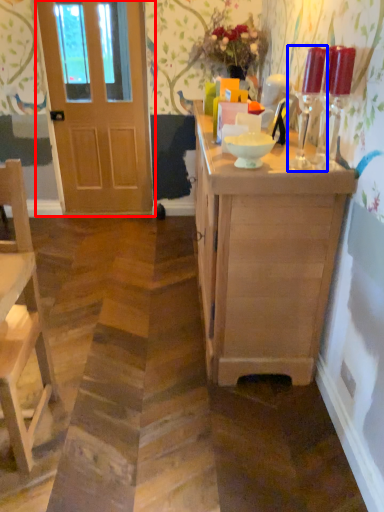
Question: Which object appears closest to the camera in this image, door (highlighted by a red box) or candle holder (highlighted by a blue box)?

Choices:
 (A) door
 (B) candle holder

Answer: (B)